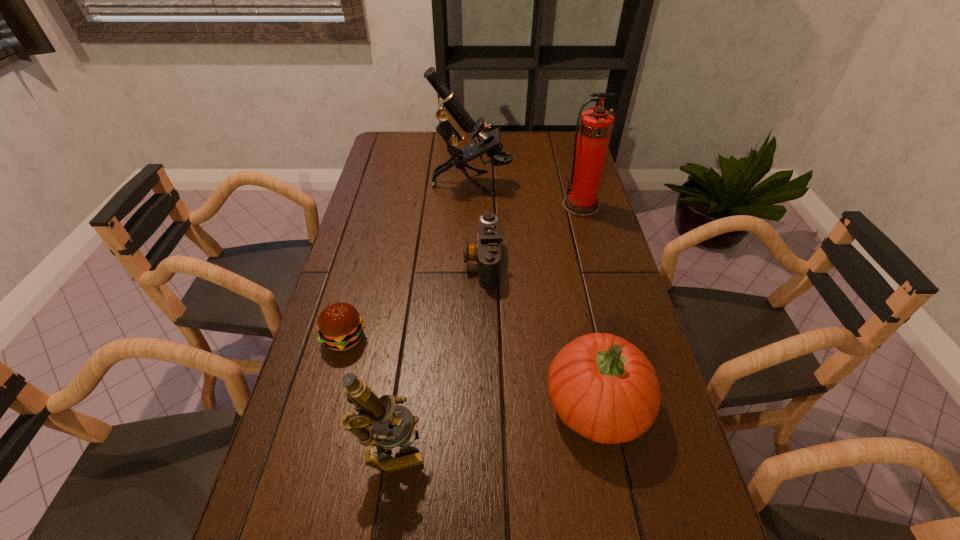
The height and width of the screenshot is (540, 960). Find the location of `vacant region at the far edge of the desktop`. vacant region at the far edge of the desktop is located at coordinates (438, 137).

The width and height of the screenshot is (960, 540). Identify the location of free space at the left edge. click(347, 281).

You are a GUI agent. You are given a task and a screenshot of the screen. Output one action in this format:
    pyautogui.click(x=<x>, y=<y>)
    Task: Click on the vacant region at the right edge of the desktop
    The height and width of the screenshot is (540, 960).
    Given the screenshot: What is the action you would take?
    pyautogui.click(x=561, y=188)

In the image, there is a desktop. What are the coordinates of `vacant area at the far left corner` in the screenshot? It's located at (374, 156).

Where is `unoccupied position between the third shortest object and the camera`? Image resolution: width=960 pixels, height=540 pixels. unoccupied position between the third shortest object and the camera is located at coordinates (540, 333).

Where is `free spot between the third tallest object and the taller microscope`? free spot between the third tallest object and the taller microscope is located at coordinates [432, 317].

I want to click on free spot between the fire extinguisher and the camera, so click(532, 233).

In order to click on free area in between the farther microscope and the fourth tallest object in this screenshot , I will do `click(535, 293)`.

The image size is (960, 540). I want to click on unoccupied area between the camera and the pumpkin, so click(x=540, y=333).

Find the location of `object that is the third closest to the leftmost object`. object that is the third closest to the leftmost object is located at coordinates (603, 387).